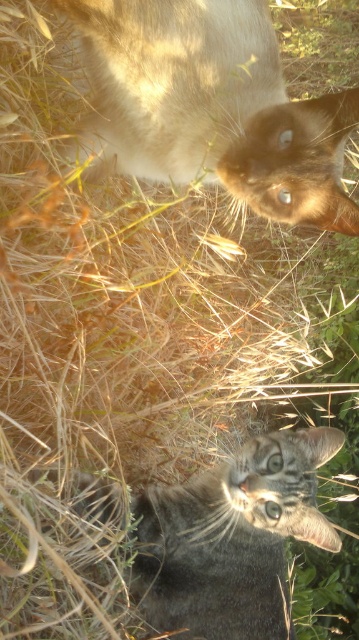
Question: Can you confirm if brown fur cat at upper center is wider than gray tabby cat at lower center?

Choices:
 (A) no
 (B) yes

Answer: (A)

Question: Which object is closer to the camera taking this photo?

Choices:
 (A) gray tabby cat at lower center
 (B) brown fur cat at upper center

Answer: (B)

Question: Does brown fur cat at upper center appear over gray tabby cat at lower center?

Choices:
 (A) yes
 (B) no

Answer: (A)

Question: Is brown fur cat at upper center positioned at the back of gray tabby cat at lower center?

Choices:
 (A) no
 (B) yes

Answer: (A)